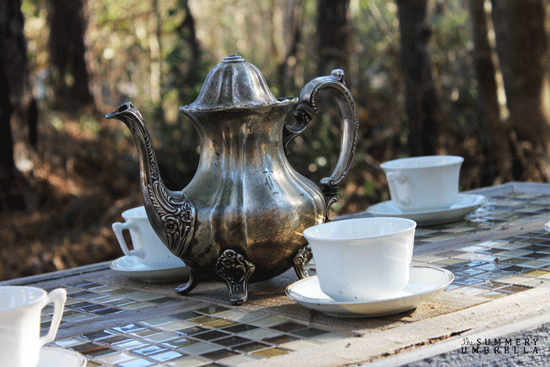
The height and width of the screenshot is (367, 550). In order to click on kettle in this screenshot , I will do `click(238, 169)`.